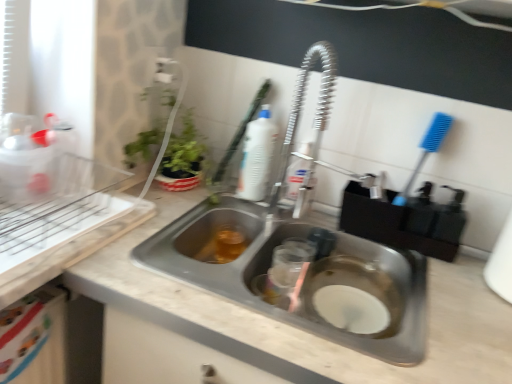
Question: From the image's perspective, is white plastic bottle at upper center, the second cleaning product positioned from the right, positioned above or below metallic stainless steel sink at center?

Choices:
 (A) below
 (B) above

Answer: (B)

Question: In terms of width, does white plastic bottle at upper center, the second cleaning product positioned from the right, look wider or thinner when compared to metallic stainless steel sink at center?

Choices:
 (A) wide
 (B) thin

Answer: (B)

Question: Estimate the real-world distances between objects in this image. Which object is closer to the white plastic brush at upper center?

Choices:
 (A) translucent amber liquid at sink left
 (B) white plastic bottle at upper center, which is the 1th cleaning product in left-to-right order
 (C) metallic stainless steel sink at center
 (D) stainless steel sink at center
 (E) translucent plastic bottle at center, marked as the 1th cleaning product in a right-to-left arrangement

Answer: (B)

Question: Based on their relative distances, which object is nearer to the white plastic brush at upper center?

Choices:
 (A) stainless steel sink at center
 (B) translucent amber liquid at sink left
 (C) translucent plastic bottle at center, positioned as the 2th cleaning product in left-to-right order
 (D) metallic stainless steel sink at center
 (E) white plastic bottle at upper center, the second cleaning product positioned from the right

Answer: (E)